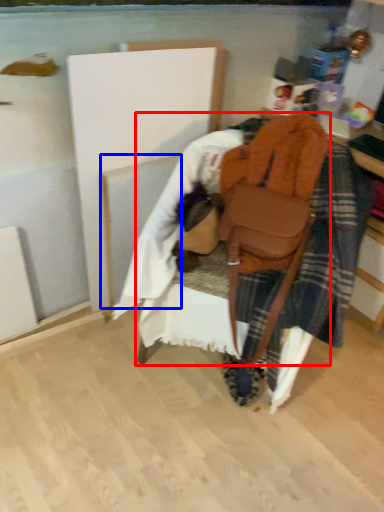
Question: Which object appears farthest to the camera in this image, furniture (highlighted by a red box) or wood (highlighted by a blue box)?

Choices:
 (A) furniture
 (B) wood

Answer: (B)